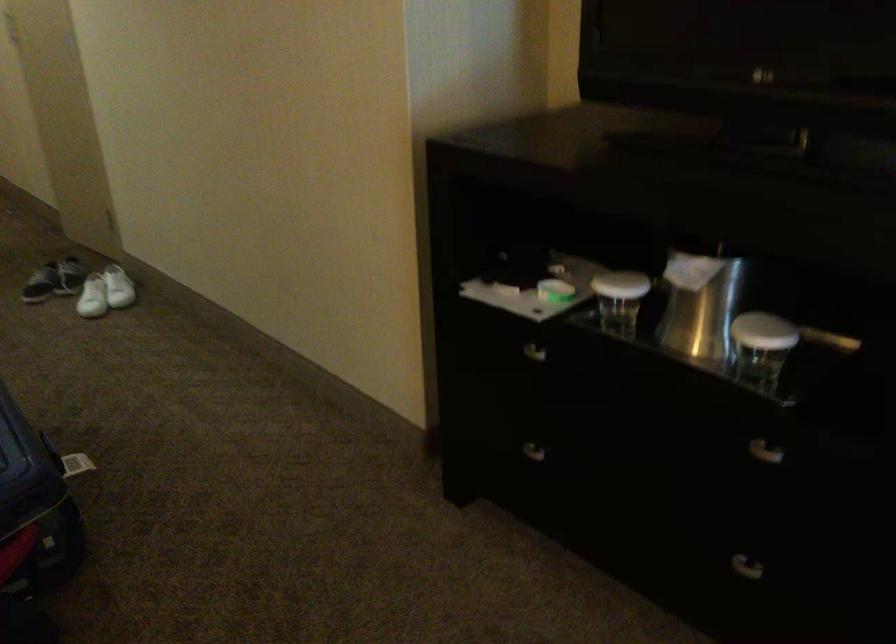
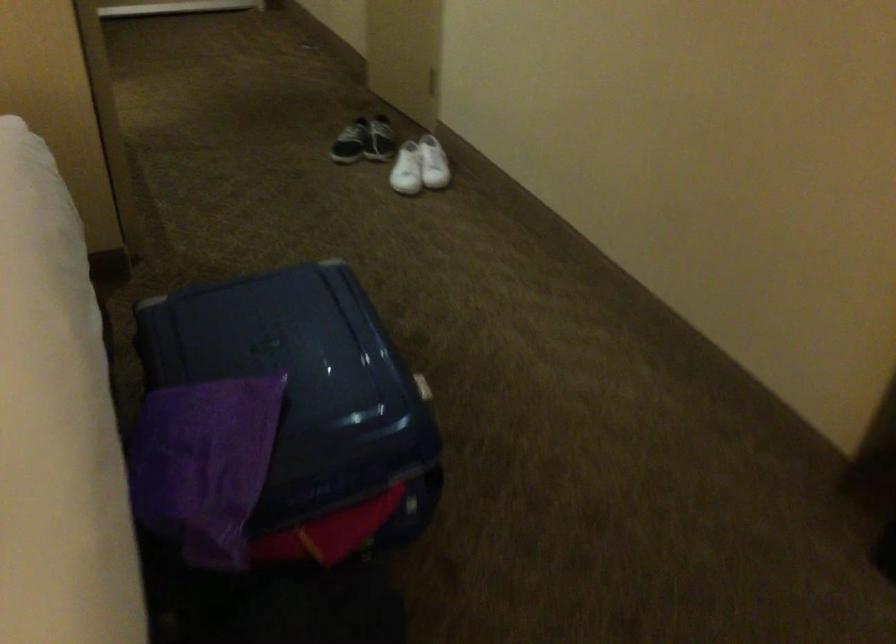
Question: The camera is either moving clockwise (left) or counter-clockwise (right) around the object. The first image is from the beginning of the video and the second image is from the end. Is the camera moving left or right when shooting the video?

Choices:
 (A) Left
 (B) Right

Answer: (B)